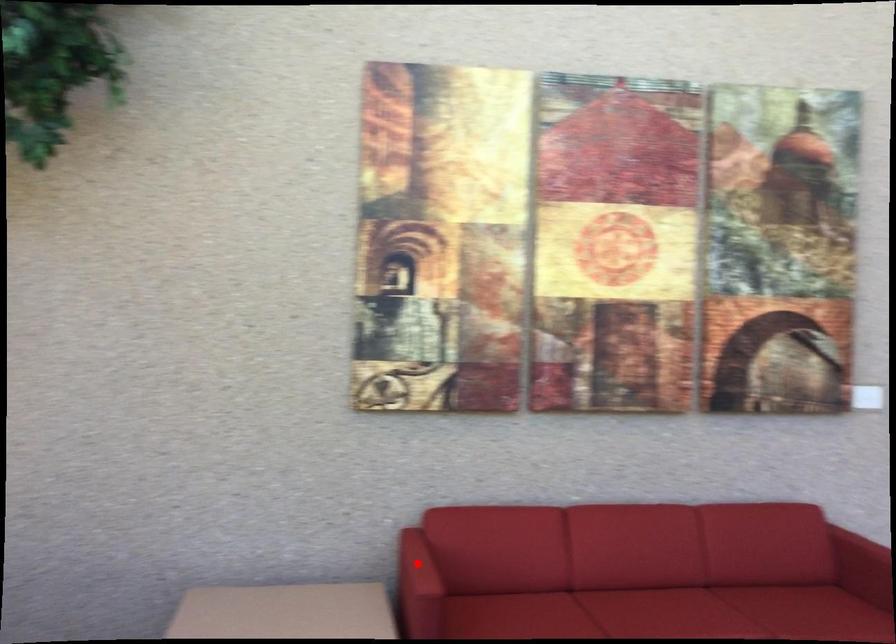
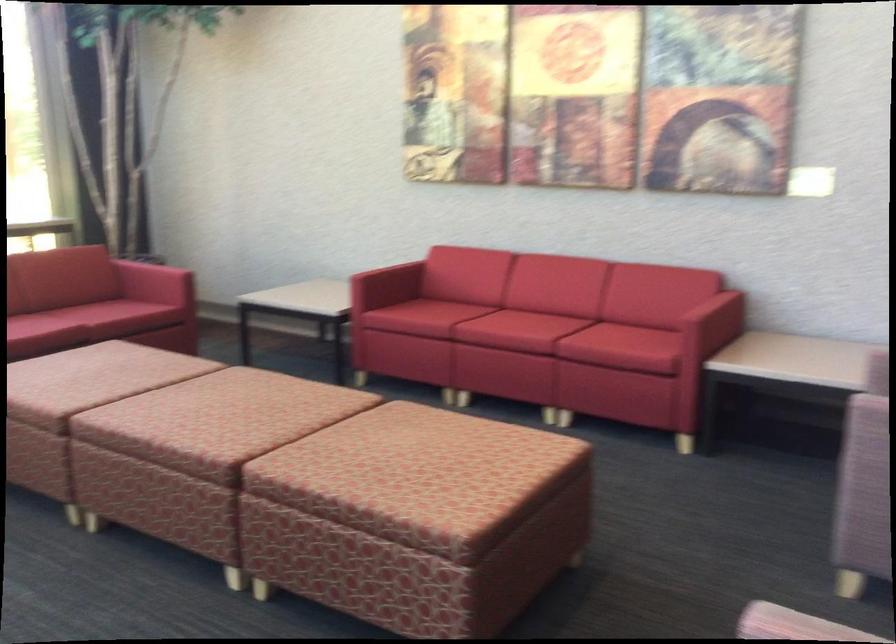
Question: I am providing you with two images of the same scene from different viewpoints. A red point is marked on the first image. Is the red point's position out of view in image 2?

Choices:
 (A) Yes
 (B) No

Answer: (A)